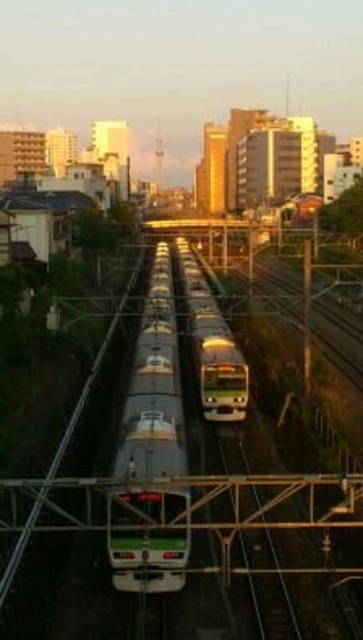
Can you confirm if silver metallic train at center is smaller than green metallic train at center?

Yes.

Which is more to the left, silver metallic train at center or green metallic train at center?

From the viewer's perspective, silver metallic train at center appears more on the left side.

Between point (169, 532) and point (226, 365), which one is positioned behind?

Positioned behind is point (226, 365).

Find the location of `silver metallic train at center`. silver metallic train at center is located at coordinates (153, 387).